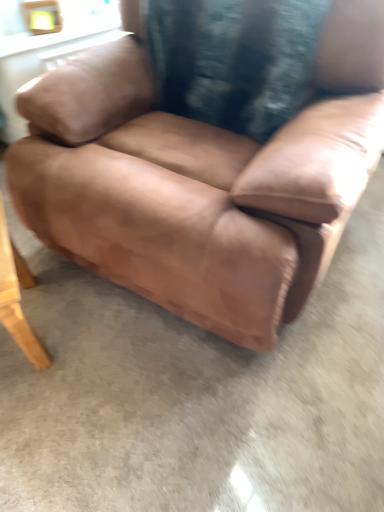
I want to click on free space to the right of wooden table at lower left, so click(104, 330).